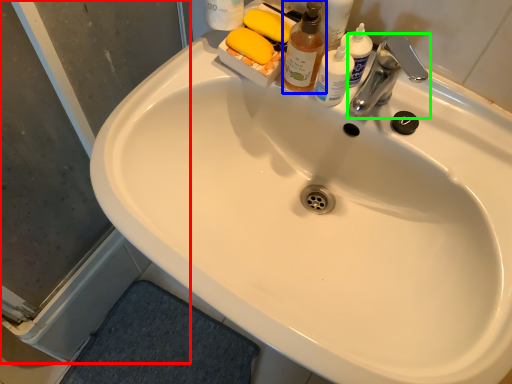
Question: Considering the real-world distances, which object is farthest from screen door (highlighted by a red box)? cleaning product (highlighted by a blue box) or tap (highlighted by a green box)?

Choices:
 (A) cleaning product
 (B) tap

Answer: (B)